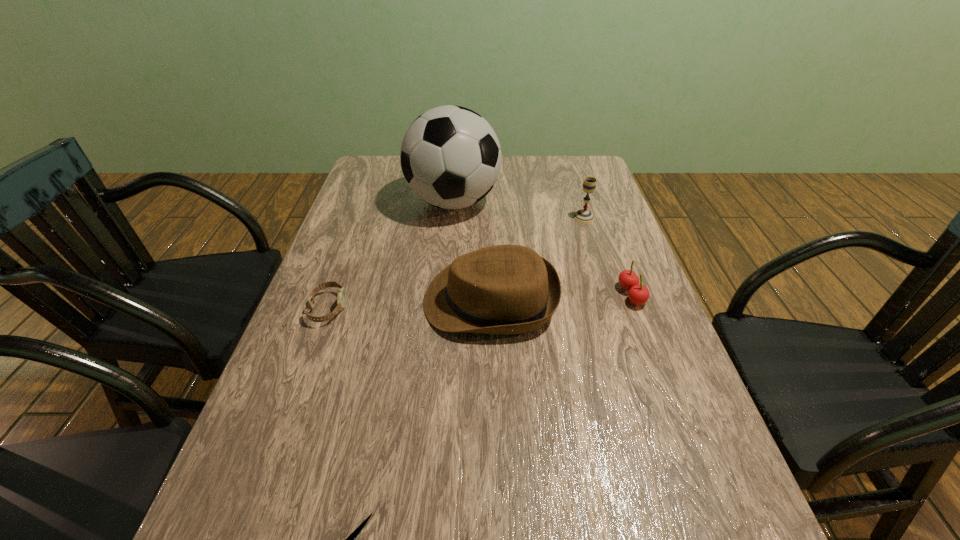
Locate an element on the screen. free region located 0.190m on the front-facing side of the fedora is located at coordinates (x=345, y=300).

You are a GUI agent. You are given a task and a screenshot of the screen. Output one action in this format:
    pyautogui.click(x=<x>, y=<y>)
    Task: Click on the free space located on the front of the third shortest object
    Image resolution: width=960 pixels, height=540 pixels.
    Given the screenshot: What is the action you would take?
    pyautogui.click(x=654, y=353)

The width and height of the screenshot is (960, 540). I want to click on free space located on the face of the fifth tallest object, so click(408, 308).

You are a GUI agent. You are given a task and a screenshot of the screen. Output one action in this format:
    pyautogui.click(x=<x>, y=<y>)
    Task: Click on the object that is at the far edge
    
    Given the screenshot: What is the action you would take?
    pyautogui.click(x=450, y=156)

Locate an element on the screen. The width and height of the screenshot is (960, 540). object located in the left edge section of the desktop is located at coordinates (341, 297).

Where is `chalice that is positioned at the right edge`? The height and width of the screenshot is (540, 960). chalice that is positioned at the right edge is located at coordinates (585, 216).

The width and height of the screenshot is (960, 540). Identify the location of cherry that is at the right edge. (638, 294).

In order to click on vacant space at the far edge in this screenshot , I will do `click(536, 184)`.

In the image, there is a desktop. At what (x,y) coordinates should I click in order to perform the action: click on vacant space at the left edge. Please return your answer as a coordinate pair (x, y). This screenshot has height=540, width=960. Looking at the image, I should click on (390, 211).

Image resolution: width=960 pixels, height=540 pixels. Find the location of `vacant space at the right edge`. vacant space at the right edge is located at coordinates (606, 199).